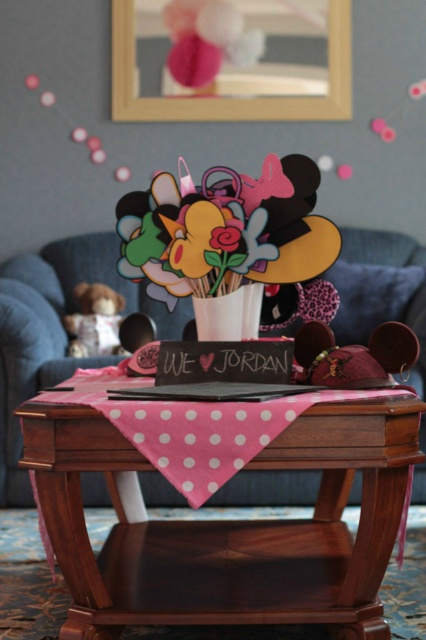
Which of these two, wooden table at center or matte pink fabric armchair at center, stands shorter?

wooden table at center

Can you confirm if wooden table at center is smaller than matte pink fabric armchair at center?

Indeed, wooden table at center has a smaller size compared to matte pink fabric armchair at center.

Which is in front, point (108, 486) or point (46, 364)?

Positioned in front is point (108, 486).

This screenshot has width=426, height=640. I want to click on wooden table at center, so click(x=227, y=525).